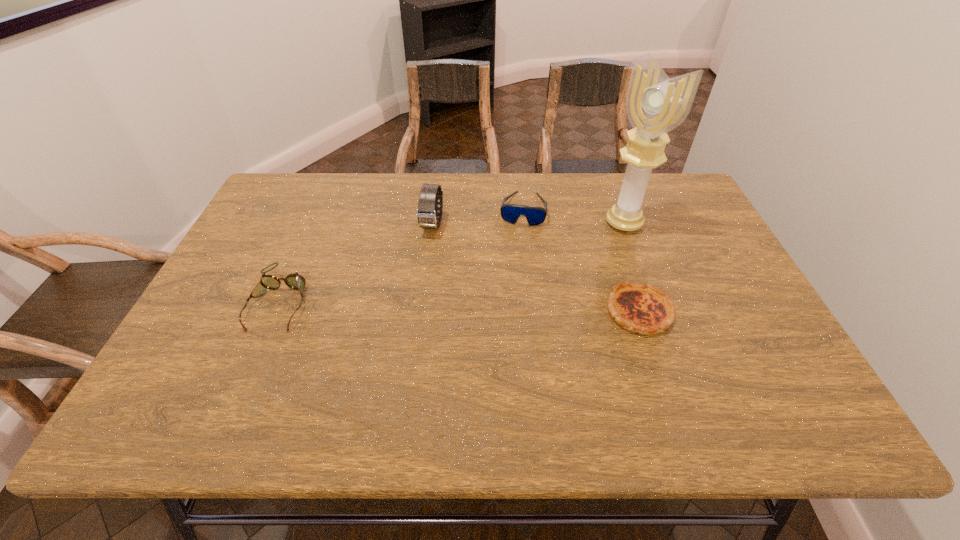
At what (x,y) coordinates should I click in order to perform the action: click on vacant space on the desktop that is between the spectacles and the shortest object and is positioned on the face of the second tallest object. Please return your answer as a coordinate pair (x, y). Looking at the image, I should click on (408, 305).

In order to click on free spot on the desktop that is between the spectacles and the shortest object and is positioned on the front-facing side of the tallest object in this screenshot , I will do `click(493, 307)`.

Where is `free space on the desktop that is between the leftmost object and the quiche and is positioned on the front-facing side of the sunglasses`? free space on the desktop that is between the leftmost object and the quiche and is positioned on the front-facing side of the sunglasses is located at coordinates (506, 308).